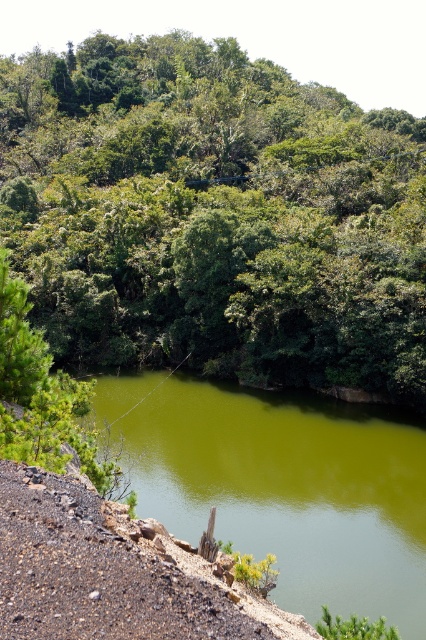
You are standing at the edge of the water in the image and want to reach the green leafy tree at upper center. Which direction should you head towards?

The green leafy tree at upper center is located at point (213, 216), so you should head towards the upper center direction to reach it.

You are a hiker standing at the edge of the rocky embankment. You see the green leafy tree at upper center and the green smooth water at center. Which object is higher in the image?

The green leafy tree at upper center is higher than the green smooth water at center because it is positioned above it in the image.

You are standing at the edge of the water and want to take a photo of the green leafy tree at upper center without the green smooth water at center appearing in the background. Is this possible?

The green smooth water at center is behind the green leafy tree at upper center, so if you position yourself so the tree is between you and the water, you can take a photo of the green leafy tree at upper center without the green smooth water at center in the background.